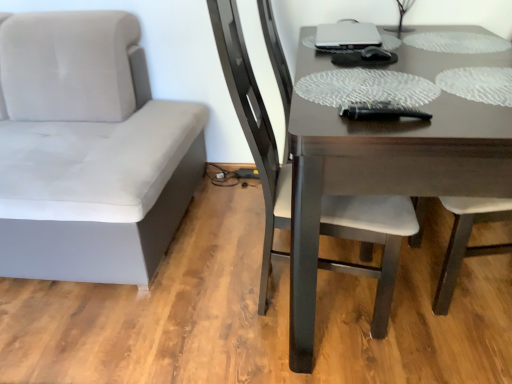
Locate an element on the screen. unoccupied area in front of satin silver laptop at upper center is located at coordinates (389, 52).